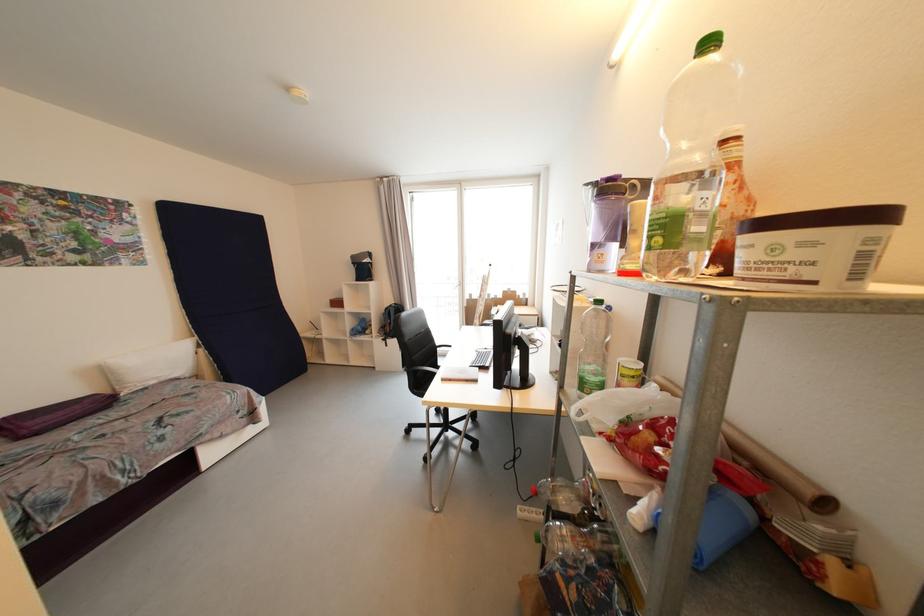
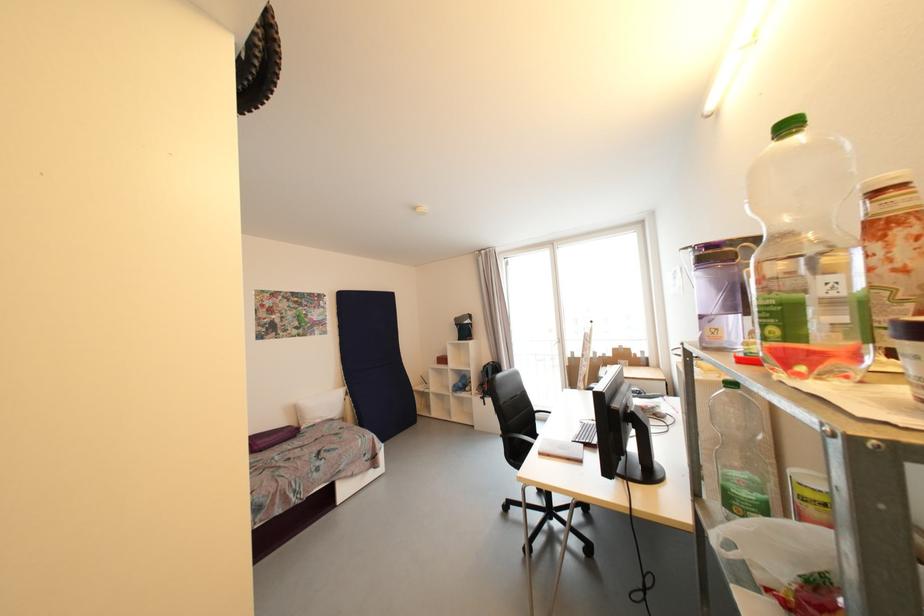
Question: I am providing you with two images of the same scene from different viewpoints. After the viewpoint changes to image2, which objects are now occluded?

Choices:
 (A) purple bolster pillow
 (B) black chair armrest
 (C) clear plastic bottle
 (D) none of these

Answer: (D)